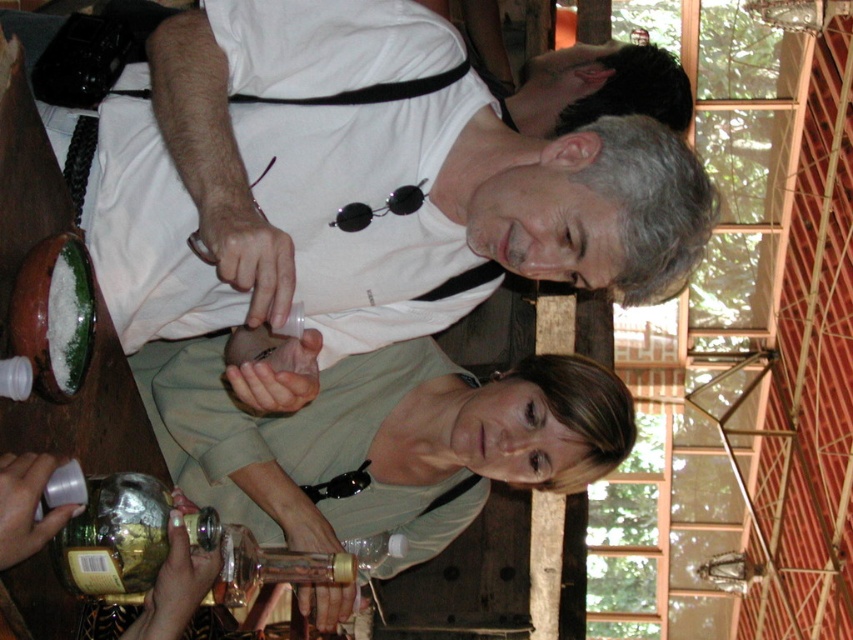
Question: In this image, where is white matte shirt at upper center located relative to green matte shirt at center?

Choices:
 (A) right
 (B) left

Answer: (A)

Question: Which point is closer to the camera?

Choices:
 (A) shiny metallic bottle at lower left
 (B) white matte shirt at upper center
 (C) green matte shirt at center

Answer: (A)

Question: Is white matte shirt at upper center to the left of green matte shirt at center from the viewer's perspective?

Choices:
 (A) no
 (B) yes

Answer: (A)

Question: Is white matte shirt at upper center thinner than green matte shirt at center?

Choices:
 (A) yes
 (B) no

Answer: (A)

Question: Which is nearer to the white matte shirt at upper center?

Choices:
 (A) green matte shirt at center
 (B) shiny metallic bottle at lower left

Answer: (B)

Question: Among these points, which one is nearest to the camera?

Choices:
 (A) (213, 448)
 (B) (141, 536)
 (C) (302, 84)

Answer: (B)